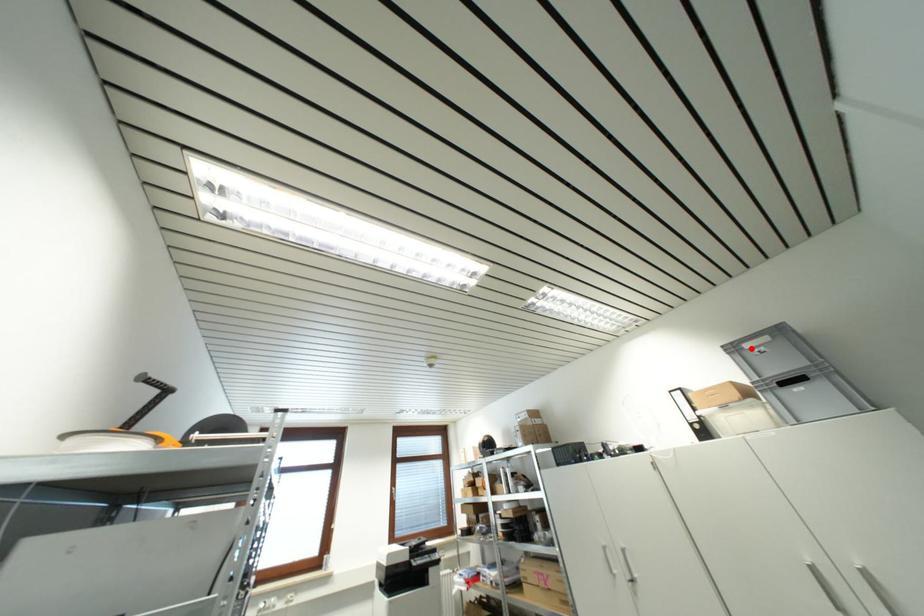
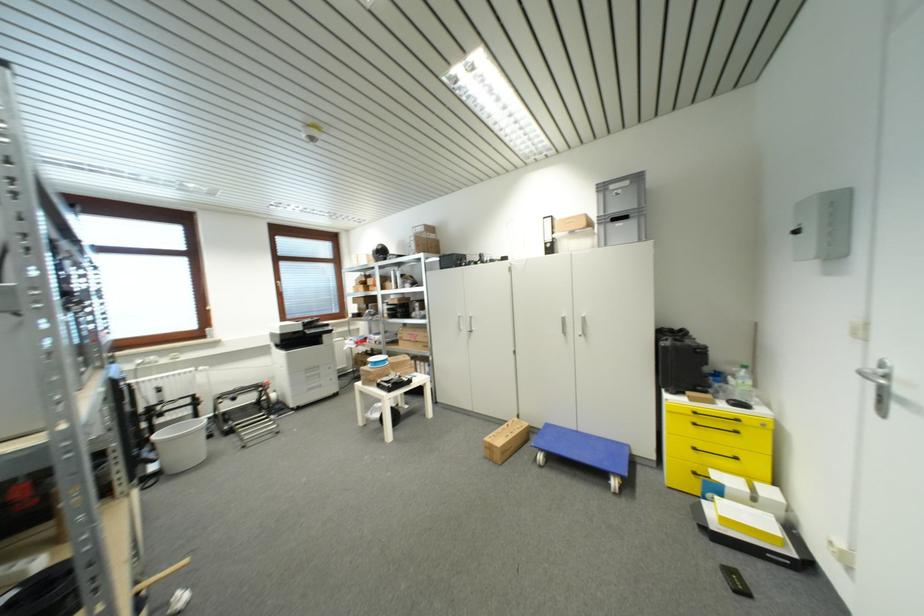
Find the pixel in the second image that matches the highlighted location in the first image.

(616, 190)